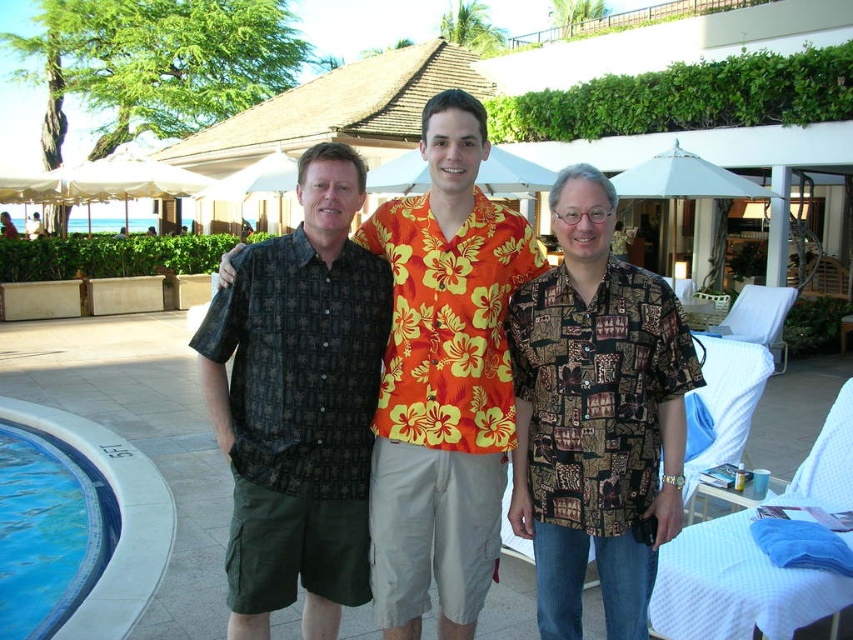
Which is above, floral print shirt at center or printed fabric shirt at center?

floral print shirt at center is higher up.

Does floral print shirt at center have a lesser height compared to printed fabric shirt at center?

No.

Is point (399, 257) behind point (635, 468)?

Yes, point (399, 257) is behind point (635, 468).

Where is `floral print shirt at center`? This screenshot has width=853, height=640. floral print shirt at center is located at coordinates (444, 380).

Who is positioned more to the right, dark brown patterned shirt at center or printed fabric shirt at center?

From the viewer's perspective, printed fabric shirt at center appears more on the right side.

Is point (329, 307) positioned before point (627, 308)?

No, it is behind (627, 308).

Is point (308, 356) in front of point (662, 456)?

That is True.

Locate an element on the screen. The image size is (853, 640). dark brown patterned shirt at center is located at coordinates (299, 403).

Does printed fabric shirt at center have a greater width compared to blue tile swimming pool at lower left?

No.

How distant is printed fabric shirt at center from blue tile swimming pool at lower left?

The distance of printed fabric shirt at center from blue tile swimming pool at lower left is 2.95 meters.

Is point (560, 397) farther from viewer compared to point (54, 460)?

No, it is not.

You are a GUI agent. You are given a task and a screenshot of the screen. Output one action in this format:
    pyautogui.click(x=<x>, y=<y>)
    Task: Click on the printed fabric shirt at center
    Image resolution: width=853 pixels, height=640 pixels.
    Given the screenshot: What is the action you would take?
    pyautogui.click(x=596, y=416)